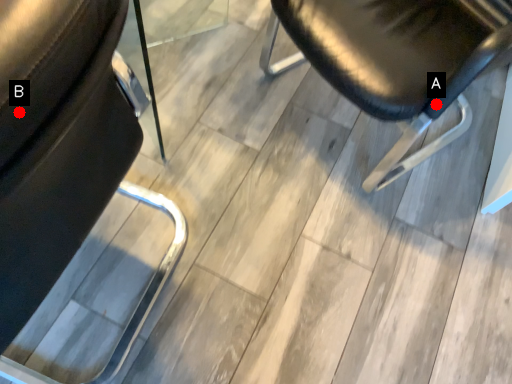
Question: Two points are circled on the image, labeled by A and B beside each circle. Which point appears farthest from the camera in this image?

Choices:
 (A) A is further
 (B) B is further

Answer: (A)